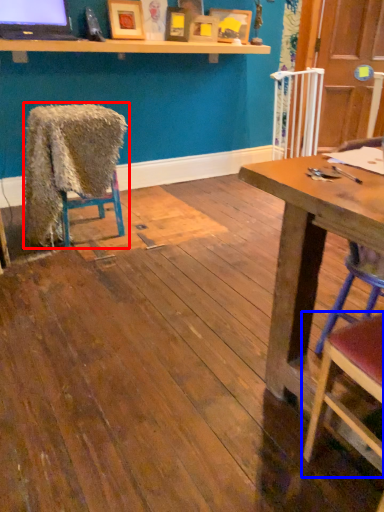
Question: Which object appears farthest to the camera in this image, chair (highlighted by a red box) or chair (highlighted by a blue box)?

Choices:
 (A) chair
 (B) chair

Answer: (A)